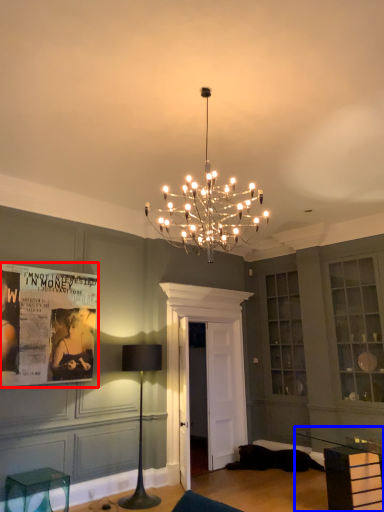
Question: Which object appears farthest to the camera in this image, poster page (highlighted by a red box) or table (highlighted by a blue box)?

Choices:
 (A) poster page
 (B) table

Answer: (A)